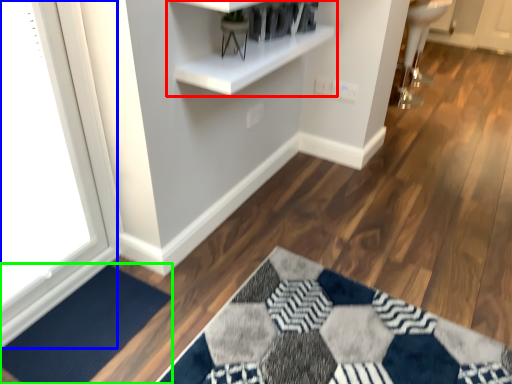
Question: Estimate the real-world distances between objects in this image. Which object is closer to shelf (highlighted by a red box), window (highlighted by a blue box) or doormat (highlighted by a green box)?

Choices:
 (A) window
 (B) doormat

Answer: (A)